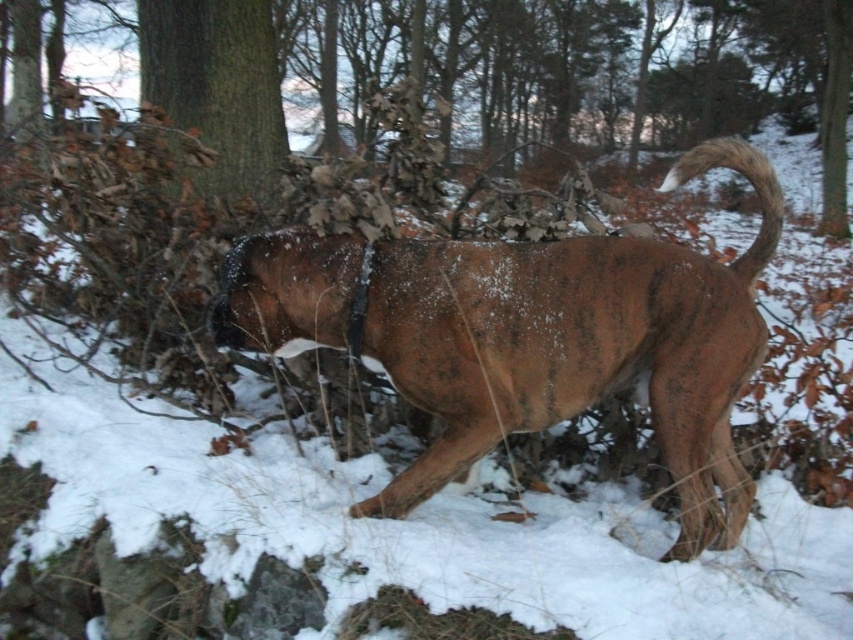
Question: Among these points, which one is farthest from the camera?

Choices:
 (A) (178, 10)
 (B) (611, 99)

Answer: (B)

Question: Which point is closer to the camera taking this photo?

Choices:
 (A) (837, 29)
 (B) (256, 48)

Answer: (B)

Question: Which object is the farthest from the brown fur dog at center?

Choices:
 (A) brown bark tree at center
 (B) brown rough bark at upper center

Answer: (A)

Question: Does brown fur dog at center have a smaller size compared to brown bark tree at center?

Choices:
 (A) no
 (B) yes

Answer: (B)

Question: Can you confirm if brown fur dog at center is positioned to the right of brown rough bark at upper center?

Choices:
 (A) yes
 (B) no

Answer: (A)

Question: From the image, what is the correct spatial relationship of brown bark tree at center in relation to brown rough bark at upper center?

Choices:
 (A) left
 (B) right

Answer: (B)